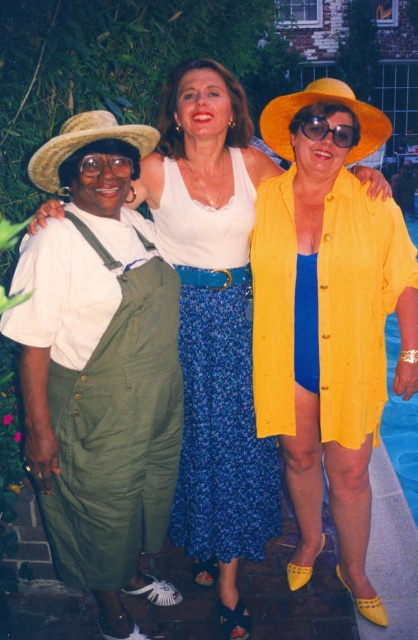
You are standing in front of the three women and want to place a small gift between the two points marked as point (300, 129) and point (84, 156). Which point should you place the gift closer to so that it appears closer to you?

You should place the gift closer to point (300, 129) because it is closer to you than point (84, 156).

You are at a social gathering and want to take a photo of the blue floral fabric dress at center and the blue smooth water at lower right. Which object is positioned to the left of the other?

The blue floral fabric dress at center is to the left of blue smooth water at lower right.